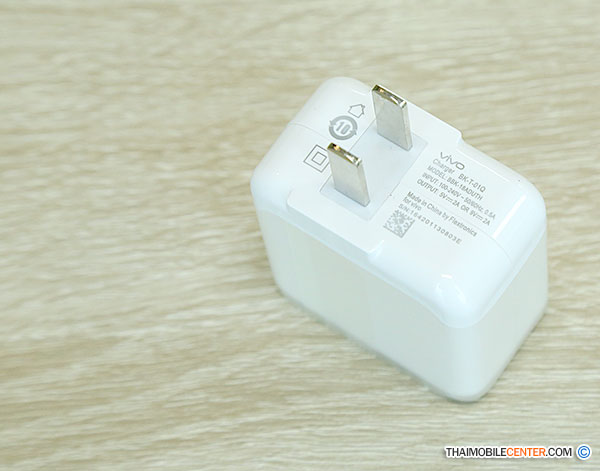
Identify the location of charging brick. The width and height of the screenshot is (600, 471). (392, 309).